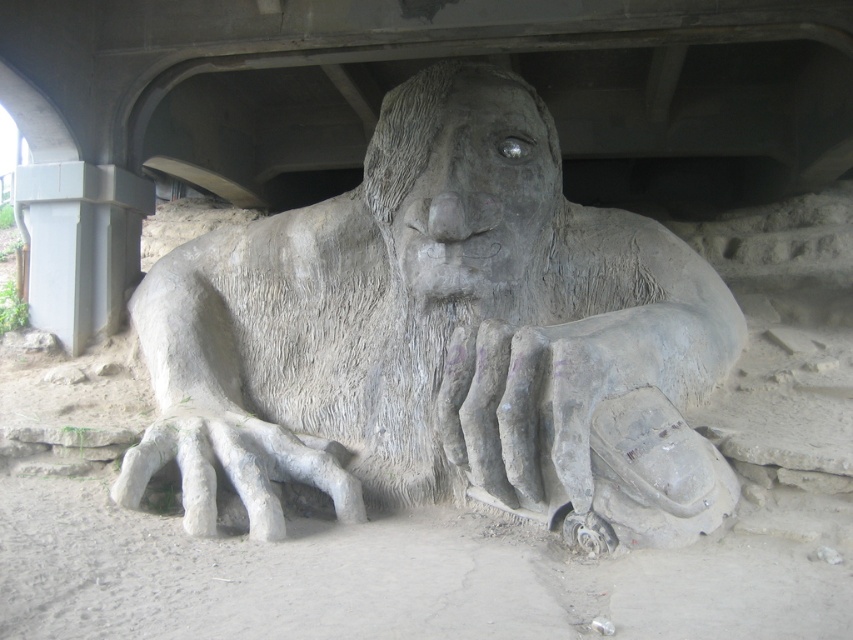
You are an architect assessing the space under a bridge. You see the gray stone statue at center and the gray concrete pillar at left. Which object is taller?

The gray stone statue at center is taller than the gray concrete pillar at left.

You are an art conservator assessing the space between the gray stone statue at center and the gray concrete pillar at left. The statue is 3 meters wide. Can you determine if the pillar is narrower than the statue?

The gray stone statue at center is wider than the gray concrete pillar at left, so the pillar is narrower than the statue.